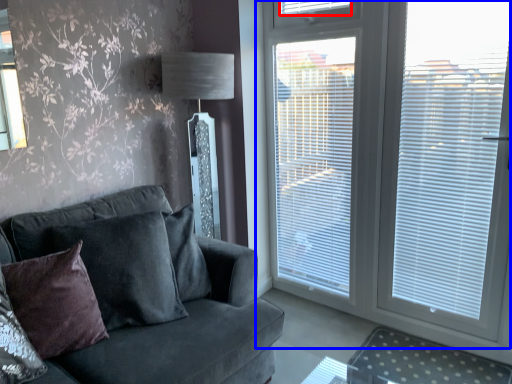
Question: Among these objects, which one is nearest to the camera, blind (highlighted by a red box) or window (highlighted by a blue box)?

Choices:
 (A) blind
 (B) window

Answer: (B)